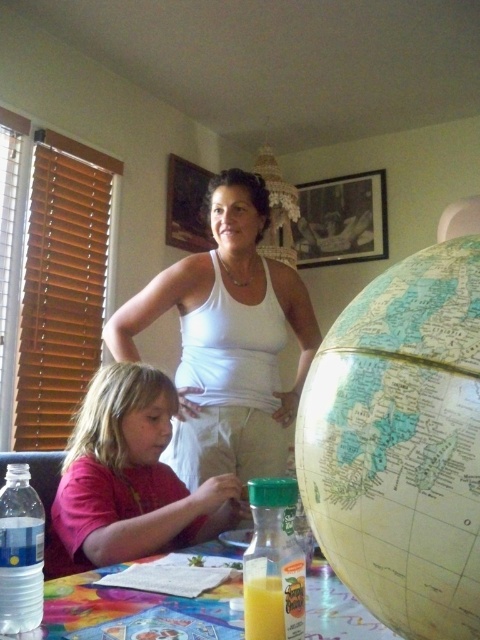
Is point (304, 305) positioned before point (274, 632)?

No, it is not.

Which is in front, point (105, 340) or point (285, 628)?

Positioned in front is point (285, 628).

Image resolution: width=480 pixels, height=640 pixels. Find the location of `white matte tank top at upper center`. white matte tank top at upper center is located at coordinates (227, 337).

Can you confirm if white matte tank top at upper center is taller than multicolored plastic table at lower center?

Yes.

Who is taller, white matte tank top at upper center or multicolored plastic table at lower center?

white matte tank top at upper center is taller.

Is point (256, 294) less distant than point (332, 582)?

That is False.

This screenshot has height=640, width=480. Identify the location of white matte tank top at upper center. (227, 337).

Is multicolored plastic table at lower center further to camera compared to translucent plastic bottle of orange juice at table?

Yes, multicolored plastic table at lower center is further from the viewer.

How distant is multicolored plastic table at lower center from translucent plastic bottle of orange juice at table?

The distance of multicolored plastic table at lower center from translucent plastic bottle of orange juice at table is 9.19 inches.

Image resolution: width=480 pixels, height=640 pixels. Describe the element at coordinates (120, 605) in the screenshot. I see `multicolored plastic table at lower center` at that location.

The height and width of the screenshot is (640, 480). I want to click on multicolored plastic table at lower center, so click(x=120, y=605).